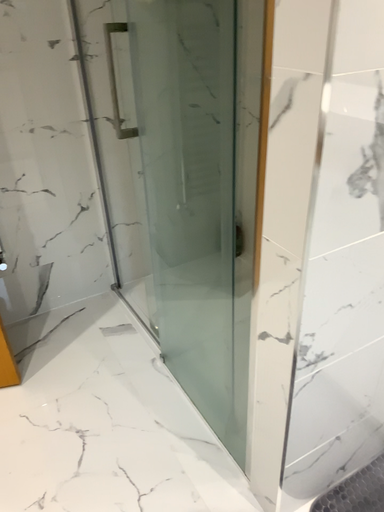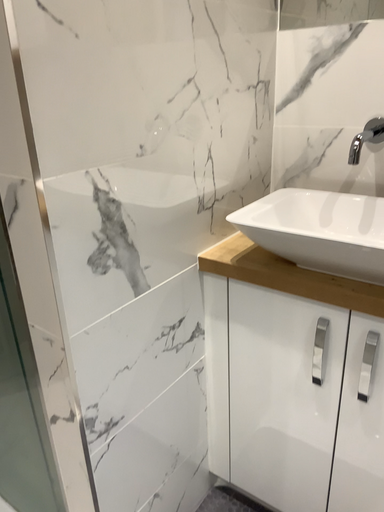
Question: How did the camera likely rotate when shooting the video?

Choices:
 (A) rotated left
 (B) rotated right

Answer: (B)